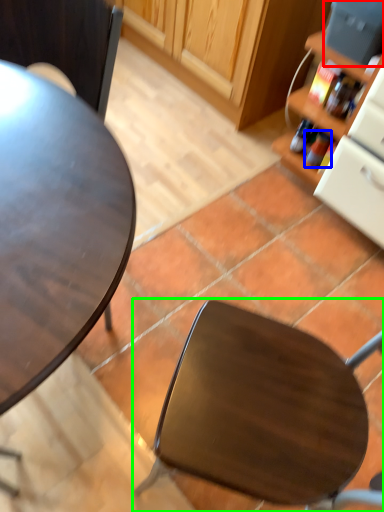
Question: Considering the real-world distances, which object is farthest from appliance (highlighted by a red box)? bottle (highlighted by a blue box) or chair (highlighted by a green box)?

Choices:
 (A) bottle
 (B) chair

Answer: (B)